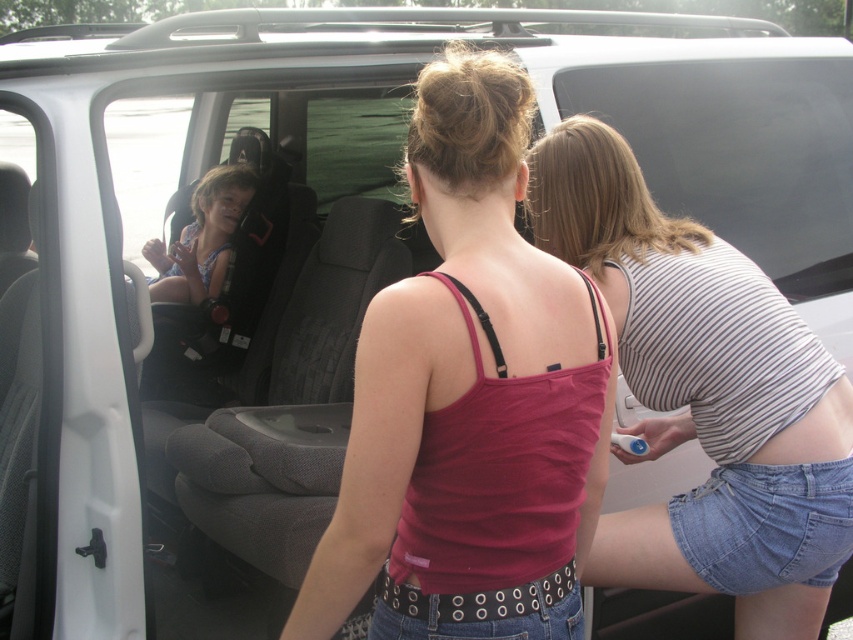
Question: Which point is farther to the camera?

Choices:
 (A) matte blue swimsuit at center
 (B) striped cotton tank top at center
 (C) pink fabric tank top at center

Answer: (A)

Question: Does pink fabric tank top at center have a larger size compared to striped cotton tank top at center?

Choices:
 (A) yes
 (B) no

Answer: (B)

Question: Among these points, which one is nearest to the camera?

Choices:
 (A) (575, 550)
 (B) (589, 268)

Answer: (A)

Question: Can you confirm if pink fabric tank top at center is smaller than matte blue swimsuit at center?

Choices:
 (A) no
 (B) yes

Answer: (A)

Question: Which object is positioned closest to the pink fabric tank top at center?

Choices:
 (A) matte blue swimsuit at center
 (B) striped cotton tank top at center

Answer: (B)

Question: Can you confirm if striped cotton tank top at center is bigger than matte blue swimsuit at center?

Choices:
 (A) yes
 (B) no

Answer: (A)